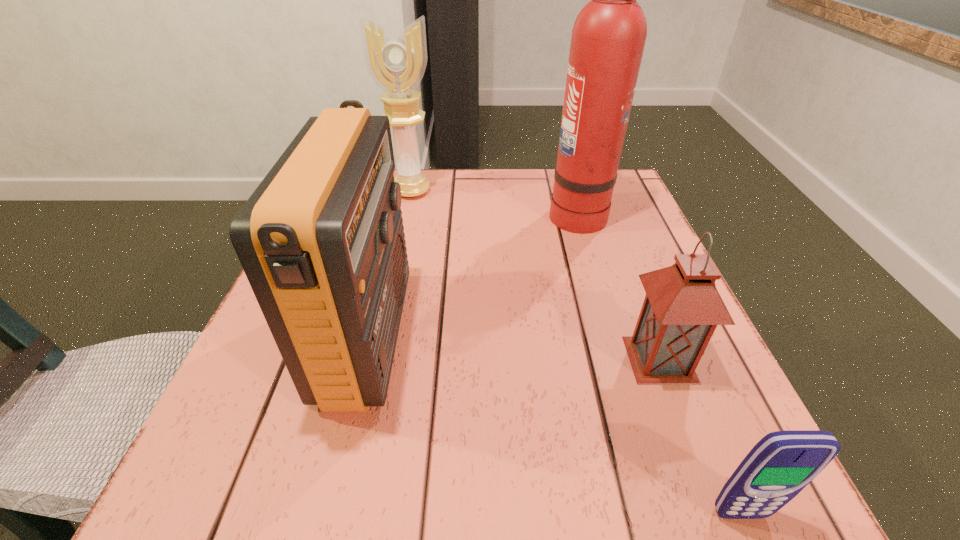
The width and height of the screenshot is (960, 540). I want to click on fire extinguisher, so click(608, 37).

At what (x,y) coordinates should I click in order to perform the action: click on award. Please return your answer as a coordinate pair (x, y). This screenshot has height=540, width=960. Looking at the image, I should click on (396, 62).

I want to click on radio receiver, so click(x=321, y=240).

I want to click on lantern, so click(682, 308).

Locate an element on the screen. The width and height of the screenshot is (960, 540). cellular telephone is located at coordinates (782, 463).

Where is `the nearest object`? The image size is (960, 540). the nearest object is located at coordinates (782, 463).

This screenshot has height=540, width=960. What are the coordinates of `free location located 0.250m on the label side of the tallest object` in the screenshot? It's located at (442, 213).

The width and height of the screenshot is (960, 540). Identify the location of free space located 0.360m on the label side of the tallest object. (395, 213).

Identify the location of vacant position located on the label side of the tallest object. This screenshot has height=540, width=960. (395, 213).

This screenshot has width=960, height=540. Identify the location of free space located 0.270m on the front-facing side of the award. (393, 273).